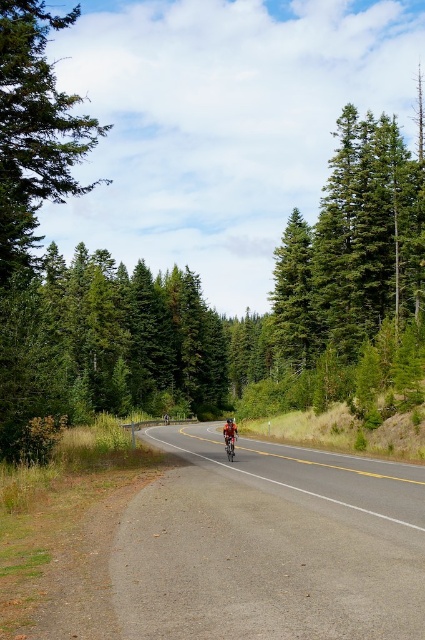
Question: Is green textured pine tree at left closer to camera compared to shiny red bicycle at center?

Choices:
 (A) no
 (B) yes

Answer: (B)

Question: Based on their relative distances, which object is nearer to the smooth asphalt road at center?

Choices:
 (A) shiny red bicycle at center
 (B) green textured pine tree at left

Answer: (A)

Question: Estimate the real-world distances between objects in this image. Which object is closer to the smooth asphalt road at center?

Choices:
 (A) shiny red bicycle at center
 (B) green textured pine tree at left

Answer: (A)

Question: Does smooth asphalt road at center have a smaller size compared to green textured pine tree at left?

Choices:
 (A) yes
 (B) no

Answer: (A)

Question: Can you confirm if smooth asphalt road at center is positioned above shiny red bicycle at center?

Choices:
 (A) no
 (B) yes

Answer: (B)

Question: Considering the real-world distances, which object is farthest from the green textured pine tree at left?

Choices:
 (A) shiny red bicycle at center
 (B) smooth asphalt road at center

Answer: (A)